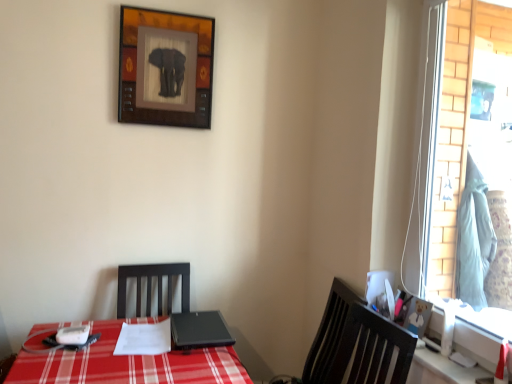
Measure the distance between point (368, 373) and camera.

1.53 meters.

Identify the location of black matte laptop at center. (199, 330).

This screenshot has height=384, width=512. I want to click on wooden bear picture frame at right, which is the second picture frame from back to front, so click(418, 316).

Where is `wooden framed elephant at upper center, placed as the second picture frame when sorted from front to back`? This screenshot has height=384, width=512. wooden framed elephant at upper center, placed as the second picture frame when sorted from front to back is located at coordinates (165, 68).

Is point (198, 16) less distant than point (206, 321)?

No, it is behind (206, 321).

Is wooden framed elephant at upper center, the second picture frame ordered from the bottom, to the left of black matte laptop at center from the viewer's perspective?

Indeed, wooden framed elephant at upper center, the second picture frame ordered from the bottom, is positioned on the left side of black matte laptop at center.

Are wooden framed elephant at upper center, the second picture frame from the right, and black matte laptop at center making contact?

No, wooden framed elephant at upper center, the second picture frame from the right, is not next to black matte laptop at center.

Which is in front, wooden framed elephant at upper center, placed as the second picture frame when sorted from front to back, or wooden bear picture frame at right, the 1th picture frame viewed from the right?

wooden bear picture frame at right, the 1th picture frame viewed from the right, is closer to the camera.

Considering the sizes of objects wooden framed elephant at upper center, which is counted as the 1th picture frame, starting from the back, and wooden bear picture frame at right, which appears as the 2th picture frame when viewed from the top, in the image provided, who is bigger, wooden framed elephant at upper center, which is counted as the 1th picture frame, starting from the back, or wooden bear picture frame at right, which appears as the 2th picture frame when viewed from the top,?

Bigger between the two is wooden framed elephant at upper center, which is counted as the 1th picture frame, starting from the back.

Is wooden framed elephant at upper center, placed as the 1th picture frame when sorted from left to right, outside of wooden bear picture frame at right, the first picture frame in the front-to-back sequence?

Indeed, wooden framed elephant at upper center, placed as the 1th picture frame when sorted from left to right, is completely outside wooden bear picture frame at right, the first picture frame in the front-to-back sequence.

Does glass window at right have a lesser width compared to dark wood chair at right?

Yes.

Looking at the image, does glass window at right seem bigger or smaller compared to dark wood chair at right?

glass window at right is smaller than dark wood chair at right.

Measure the distance from glass window at right to dark wood chair at right.

22.96 inches.

Would you say dark wood chair at right is part of glass window at right's contents?

No, dark wood chair at right is not surrounded by glass window at right.

From the image's perspective, is glass window at right under wooden bear picture frame at right, which is the first picture frame from bottom to top?

Actually, glass window at right appears above wooden bear picture frame at right, which is the first picture frame from bottom to top, in the image.

Considering the sizes of objects glass window at right and wooden bear picture frame at right, the first picture frame in the front-to-back sequence, in the image provided, who is smaller, glass window at right or wooden bear picture frame at right, the first picture frame in the front-to-back sequence,?

With smaller size is wooden bear picture frame at right, the first picture frame in the front-to-back sequence.

Find the location of a particular element. Image resolution: width=512 pixels, height=384 pixels. window in front of the wooden bear picture frame at right, the second picture frame from the left is located at coordinates (463, 150).

Looking at this image, is the surface of dark wood chair at right in direct contact with wooden bear picture frame at right, which appears as the 2th picture frame when viewed from the top?

No, dark wood chair at right is not in contact with wooden bear picture frame at right, which appears as the 2th picture frame when viewed from the top.

Which is nearer, [324,383] or [420,327]?

Point [324,383] appears to be farther away from the viewer than point [420,327].

From the image's perspective, which one is positioned lower, dark wood chair at right or wooden bear picture frame at right, which is the first picture frame from bottom to top?

dark wood chair at right is shown below in the image.

The height and width of the screenshot is (384, 512). In order to click on picture frame to the left of black matte laptop at center in this screenshot , I will do `click(165, 68)`.

Is black matte laptop at center facing away from wooden framed elephant at upper center, placed as the second picture frame when sorted from front to back?

No, wooden framed elephant at upper center, placed as the second picture frame when sorted from front to back, is not at the back of black matte laptop at center.

How different are the orientations of black matte laptop at center and wooden framed elephant at upper center, placed as the 1th picture frame when sorted from left to right, in degrees?

black matte laptop at center and wooden framed elephant at upper center, placed as the 1th picture frame when sorted from left to right, are facing 0.000159 degrees away from each other.

Is black matte laptop at center shorter than wooden framed elephant at upper center, which is counted as the 1th picture frame, starting from the back?

Yes.

Consider the image. Is light blue fabric at right at the left side of glass window at right?

No.

Is point (480, 189) closer or farther from the camera than point (463, 253)?

Point (480, 189) is positioned farther from the camera compared to point (463, 253).

Does light blue fabric at right turn towards glass window at right?

No.

This screenshot has width=512, height=384. What are the coordinates of `curtain lying behind the glass window at right` in the screenshot? It's located at (474, 239).

Identify the location of picture frame that appears behind the black matte laptop at center. (165, 68).

Identify the location of picture frame on the left side of wooden bear picture frame at right, which appears as the 2th picture frame when viewed from the top. The height and width of the screenshot is (384, 512). click(165, 68).

Estimate the real-world distances between objects in this image. Which object is closer to wooden bear picture frame at right, the 1th picture frame viewed from the right, black matte laptop at center or wooden framed elephant at upper center, which appears as the 1th picture frame when viewed from the top?

Among the two, black matte laptop at center is located nearer to wooden bear picture frame at right, the 1th picture frame viewed from the right.

Considering their positions, is glass window at right positioned further to light blue fabric at right than wooden bear picture frame at right, which is the second picture frame from back to front?

Among the two, wooden bear picture frame at right, which is the second picture frame from back to front, is located further to light blue fabric at right.

Looking at the image, which one is located further to black matte laptop at center, glass window at right or light blue fabric at right?

The object further to black matte laptop at center is glass window at right.

From the image, which object appears to be farther from dark wood chair at right, black matte laptop at center or glass window at right?

glass window at right is further to dark wood chair at right.

Estimate the real-world distances between objects in this image. Which object is further from glass window at right, wooden framed elephant at upper center, the second picture frame from the right, or wooden bear picture frame at right, which is the second picture frame from back to front?

wooden framed elephant at upper center, the second picture frame from the right.

Looking at the image, which one is located closer to light blue fabric at right, wooden framed elephant at upper center, the second picture frame from the right, or glass window at right?

The object closer to light blue fabric at right is glass window at right.

From the picture: Estimate the real-world distances between objects in this image. Which object is further from dark wood chair at right, wooden framed elephant at upper center, which is counted as the 1th picture frame, starting from the back, or wooden bear picture frame at right, which is the second picture frame from back to front?

wooden framed elephant at upper center, which is counted as the 1th picture frame, starting from the back, is further to dark wood chair at right.

From the picture: Which object lies nearer to the anchor point black matte laptop at center, dark wood chair at right or glass window at right?

dark wood chair at right lies closer to black matte laptop at center than the other object.

This screenshot has height=384, width=512. Find the location of `window between wooden framed elephant at upper center, the second picture frame from the right, and light blue fabric at right`. window between wooden framed elephant at upper center, the second picture frame from the right, and light blue fabric at right is located at coordinates (463, 150).

Where is `chair situated between black matte laptop at center and light blue fabric at right from left to right`? The image size is (512, 384). chair situated between black matte laptop at center and light blue fabric at right from left to right is located at coordinates (355, 343).

At what (x,y) coordinates should I click in order to perform the action: click on picture frame situated between wooden framed elephant at upper center, placed as the second picture frame when sorted from front to back, and glass window at right from left to right. Please return your answer as a coordinate pair (x, y). This screenshot has width=512, height=384. Looking at the image, I should click on (418, 316).

The image size is (512, 384). In order to click on window that lies between wooden framed elephant at upper center, which appears as the 1th picture frame when viewed from the top, and dark wood chair at right from top to bottom in this screenshot , I will do `click(463, 150)`.